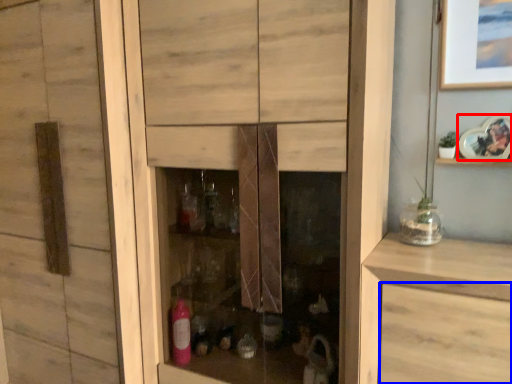
Question: Which object appears closest to the camera in this image, picture frame (highlighted by a red box) or drawer (highlighted by a blue box)?

Choices:
 (A) picture frame
 (B) drawer

Answer: (B)